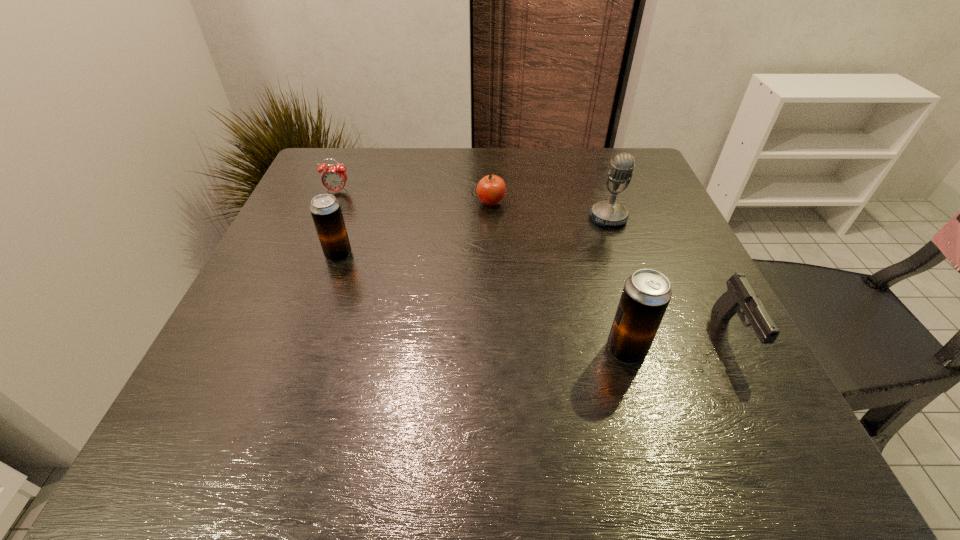
Where is `microphone that is at the right edge`? microphone that is at the right edge is located at coordinates (608, 212).

Find the location of a particular element. The width and height of the screenshot is (960, 540). pistol that is at the right edge is located at coordinates (740, 295).

You are a GUI agent. You are given a task and a screenshot of the screen. Output one action in this format:
    pyautogui.click(x=<x>, y=<y>)
    Task: Click on the object that is at the far left corner
    
    Given the screenshot: What is the action you would take?
    pyautogui.click(x=333, y=178)

Where is `object at the near right corner`? object at the near right corner is located at coordinates (740, 295).

Locate an element on the screen. This screenshot has height=540, width=960. vacant area at the far edge of the desktop is located at coordinates (435, 150).

In the image, there is a desktop. At what (x,y) coordinates should I click in order to perform the action: click on free space at the near edge. Please return your answer as a coordinate pair (x, y). The width and height of the screenshot is (960, 540). Looking at the image, I should click on (396, 363).

The image size is (960, 540). Find the location of `vacant area at the left edge`. vacant area at the left edge is located at coordinates (262, 309).

Where is `free spot at the right edge of the desktop`? This screenshot has height=540, width=960. free spot at the right edge of the desktop is located at coordinates (663, 197).

This screenshot has height=540, width=960. Find the location of `free space at the far left corner of the desktop`. free space at the far left corner of the desktop is located at coordinates (313, 185).

In the image, there is a desktop. Identify the location of vacant space at the near left corner. (256, 374).